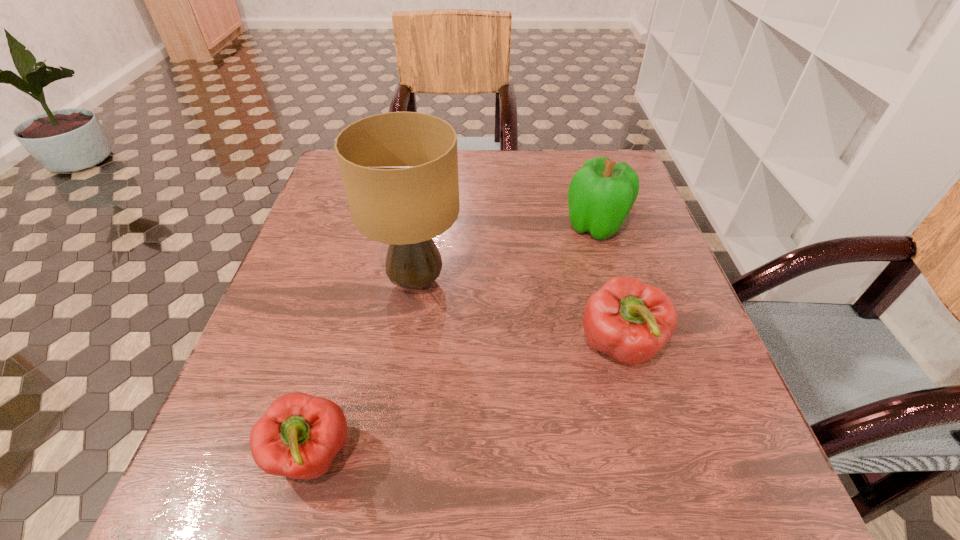
Find the location of `vacant point located between the lampshade and the second shortest object`. vacant point located between the lampshade and the second shortest object is located at coordinates (518, 314).

Where is `vacant point located between the second tallest bell pepper and the lampshade`? The height and width of the screenshot is (540, 960). vacant point located between the second tallest bell pepper and the lampshade is located at coordinates (518, 314).

Where is `free point between the tallest bell pepper and the tallest object`? The height and width of the screenshot is (540, 960). free point between the tallest bell pepper and the tallest object is located at coordinates (506, 253).

The width and height of the screenshot is (960, 540). In order to click on vacant area that lies between the second nearest bell pepper and the lampshade in this screenshot , I will do 518,314.

This screenshot has width=960, height=540. Find the location of `free spot between the shortest object and the second nearest bell pepper`. free spot between the shortest object and the second nearest bell pepper is located at coordinates (467, 401).

Locate an element on the screen. The image size is (960, 540). free space between the shortest object and the second tallest object is located at coordinates (454, 340).

Where is `vacant area between the tallest bell pepper and the lampshade`? The width and height of the screenshot is (960, 540). vacant area between the tallest bell pepper and the lampshade is located at coordinates (506, 253).

The width and height of the screenshot is (960, 540). Find the location of `object that is the third closest one to the leftmost bell pepper`. object that is the third closest one to the leftmost bell pepper is located at coordinates (601, 194).

I want to click on object that stands as the third closest to the tallest object, so click(601, 194).

Identify the location of bell pepper that stands as the second closest to the farthest bell pepper. (299, 435).